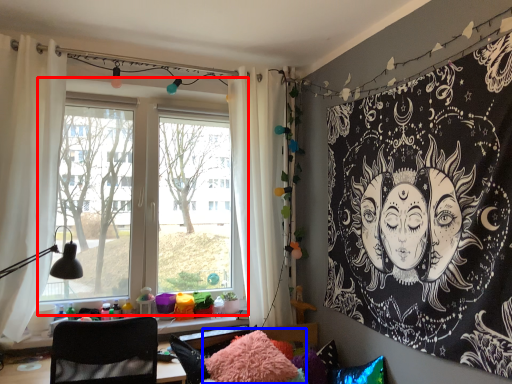
Question: Which of the following is the closest to the observer, window (highlighted by a red box) or pillow (highlighted by a blue box)?

Choices:
 (A) window
 (B) pillow

Answer: (B)